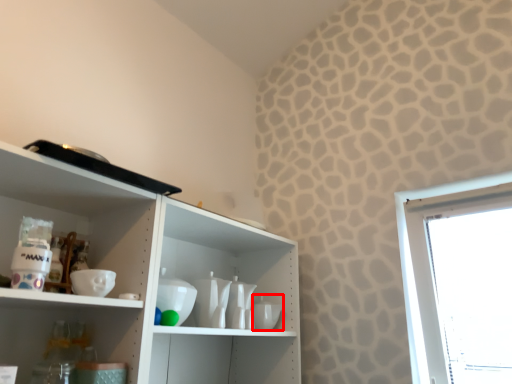
Question: Observing the image, what is the correct spatial positioning of tableware (annotated by the red box) in reference to tableware?

Choices:
 (A) right
 (B) left

Answer: (A)